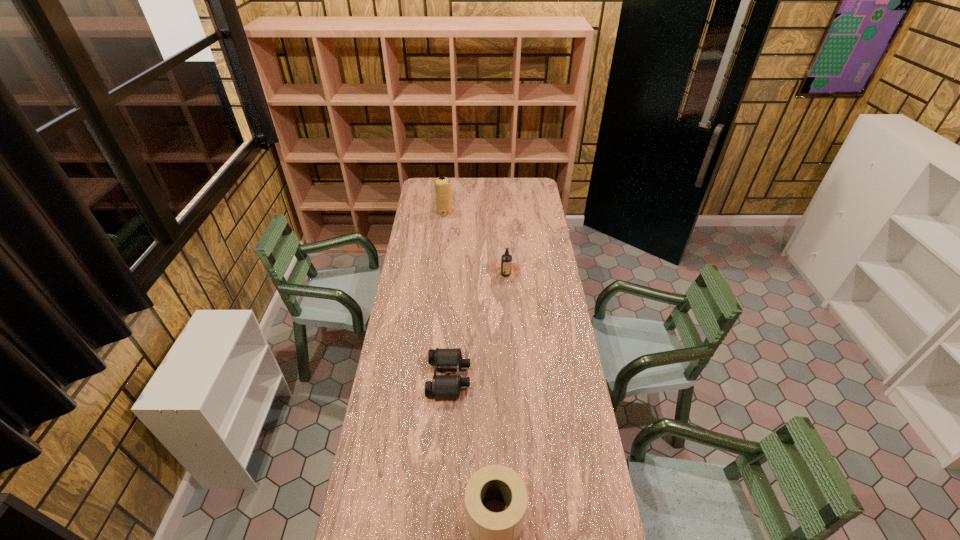
Where is `vacant area at the left edge`? vacant area at the left edge is located at coordinates (385, 435).

Find the location of a particular element. Image resolution: width=960 pixels, height=540 pixels. free location at the right edge is located at coordinates (578, 376).

Where is `vacant position at the far right corner of the desktop`? This screenshot has height=540, width=960. vacant position at the far right corner of the desktop is located at coordinates (529, 196).

Locate an element on the screen. free space that is in between the third nearest object and the aerosol can is located at coordinates (475, 244).

This screenshot has height=540, width=960. In order to click on vacant space that's between the third farthest object and the second farthest object in this screenshot , I will do `click(477, 326)`.

I want to click on unoccupied area between the second tallest object and the tallest object, so click(x=475, y=244).

At what (x,y) coordinates should I click in order to perform the action: click on free space between the third farthest object and the farthest object. Please return your answer as a coordinate pair (x, y). Looking at the image, I should click on (446, 295).

Identify which object is the closest to the third tallest object. Please provide its 2D coordinates. Your answer should be formatted as a tuple, i.e. [(x, y)], where the tuple contains the x and y coordinates of a point satisfying the conditions above.

[(442, 386)]

This screenshot has height=540, width=960. Find the location of `object that can be found as the third closest to the shortest object`. object that can be found as the third closest to the shortest object is located at coordinates (442, 184).

At what (x,y) coordinates should I click in order to perform the action: click on vacant point that satisfies the following two spatial constraints: 1. on the label of the root beer; 2. through the eyepieces of the shortest object. Please return your answer as a coordinate pair (x, y). Image resolution: width=960 pixels, height=540 pixels. Looking at the image, I should click on (513, 377).